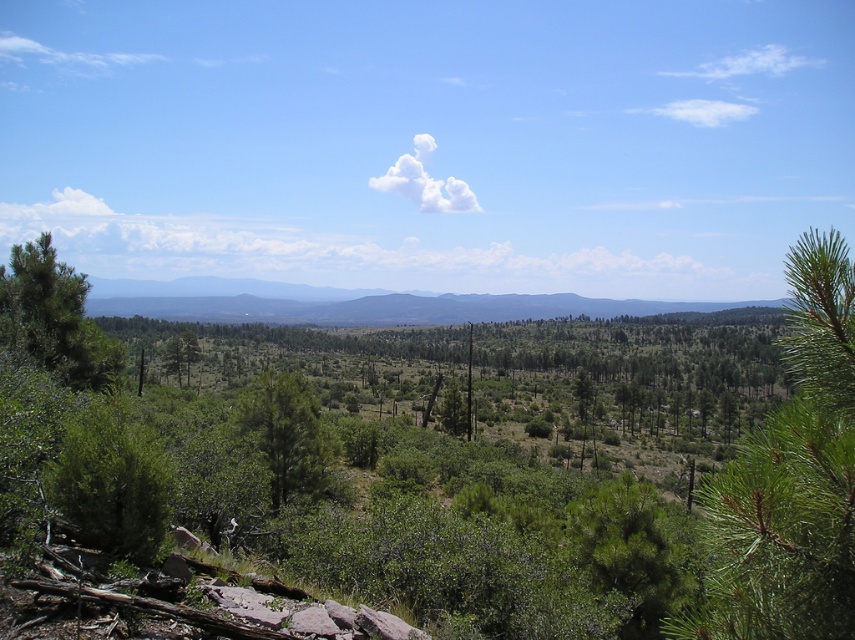
You are an explorer navigating a vast landscape. You have a map with a marked point at coordinates (x=791, y=477). Based on the image, where is this point located?

The point at coordinates (x=791, y=477) is located on the green needle like vegetation at the upper right of the image.